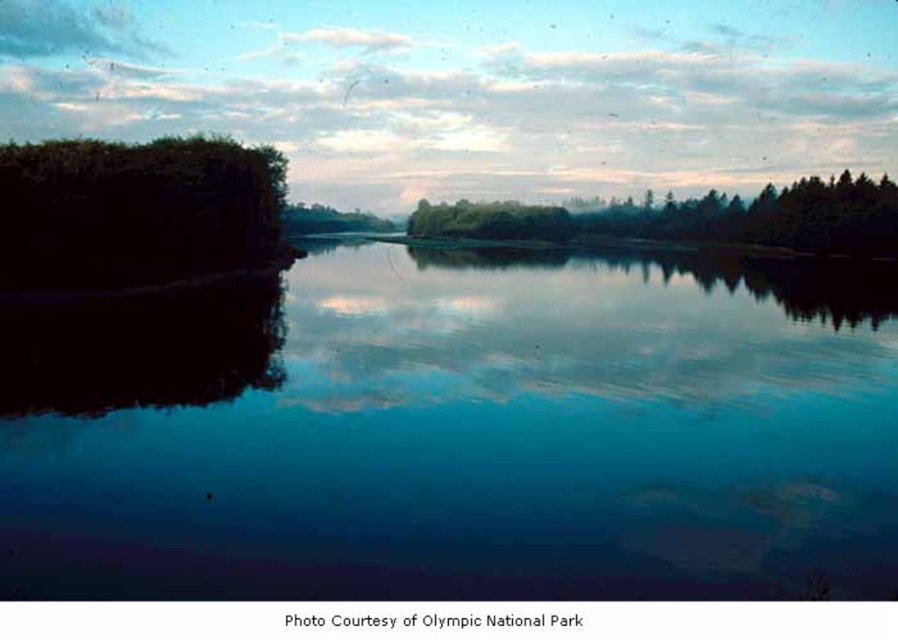
Question: Which point is closer to the camera?

Choices:
 (A) (798, 540)
 (B) (879, 193)
 (C) (180, 147)

Answer: (A)

Question: Is transparent water at center closer to the viewer compared to green matte trees at center?

Choices:
 (A) yes
 (B) no

Answer: (A)

Question: Is transparent water at center bigger than green matte trees at center?

Choices:
 (A) no
 (B) yes

Answer: (A)

Question: Which object is the closest to the green matte trees at center?

Choices:
 (A) transparent water at center
 (B) green leafy tree at left

Answer: (A)

Question: Does transparent water at center have a greater width compared to green matte trees at center?

Choices:
 (A) yes
 (B) no

Answer: (B)

Question: Which point is farther to the camera?

Choices:
 (A) transparent water at center
 (B) green matte trees at center
 (C) green leafy tree at left

Answer: (B)